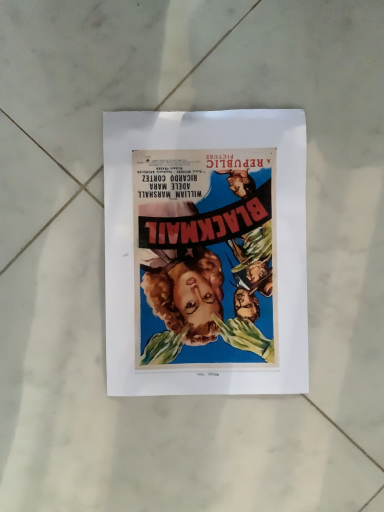
In order to click on vibrant paper poster at center in this screenshot , I will do `click(205, 252)`.

What is the approximate height of vibrant paper poster at center?

vibrant paper poster at center is 1.56 centimeters tall.

Describe the element at coordinates (205, 252) in the screenshot. I see `vibrant paper poster at center` at that location.

In order to click on vibrant paper poster at center in this screenshot , I will do `click(205, 252)`.